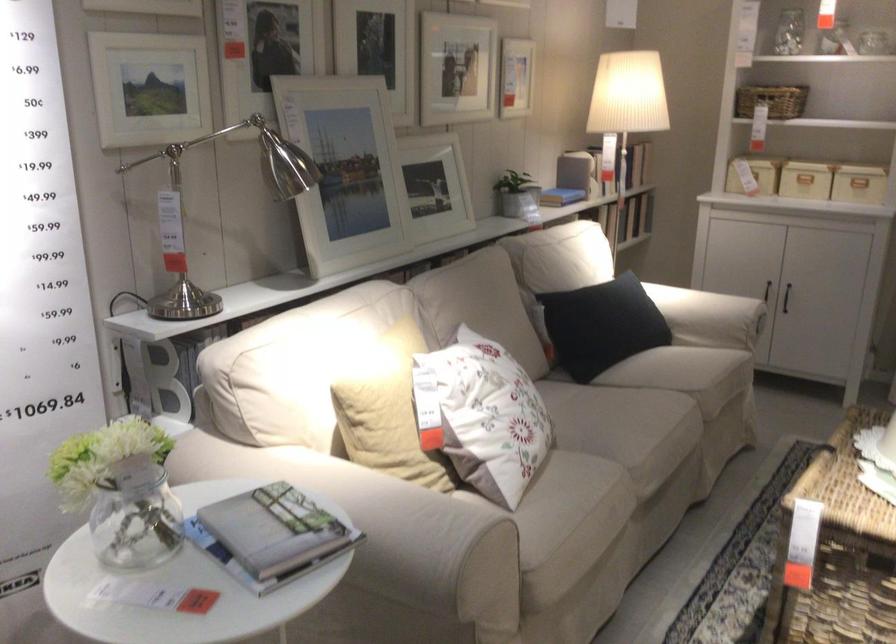
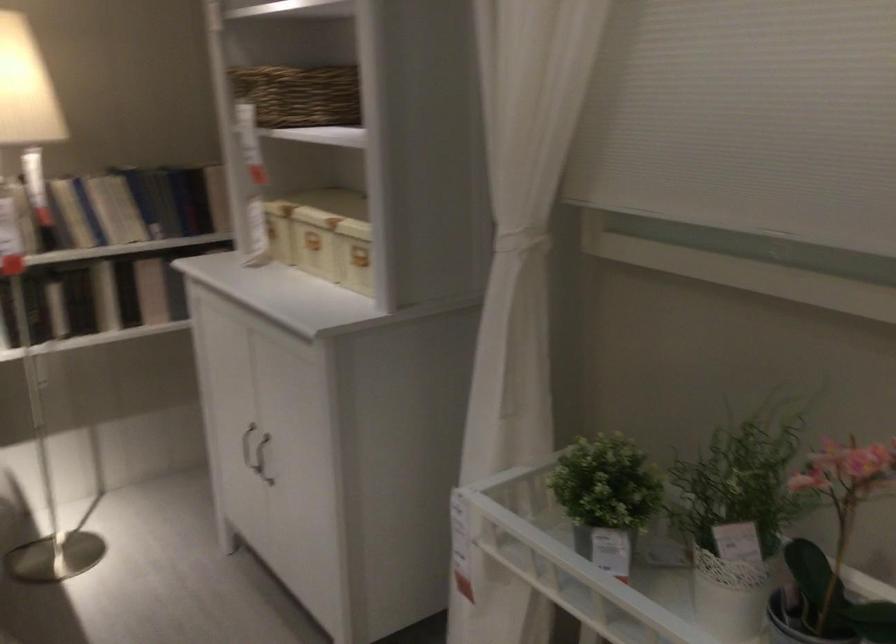
The point at (x=609, y=156) is marked in the first image. Where is the corresponding point in the second image?

(71, 213)